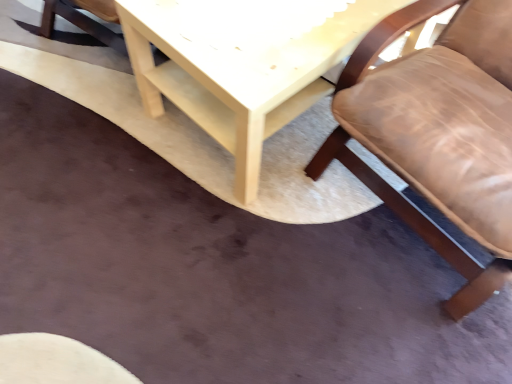
Question: Is brown leather chair at upper right inside or outside of light wood table at upper center?

Choices:
 (A) outside
 (B) inside

Answer: (A)

Question: Visually, is brown leather chair at upper right positioned to the left or to the right of light wood table at upper center?

Choices:
 (A) left
 (B) right

Answer: (B)

Question: In the image, is brown leather chair at upper right positioned in front of or behind light wood table at upper center?

Choices:
 (A) behind
 (B) front

Answer: (B)

Question: In terms of height, does light wood table at upper center look taller or shorter compared to brown leather chair at upper right?

Choices:
 (A) tall
 (B) short

Answer: (B)

Question: Is light wood table at upper center to the left or to the right of brown leather chair at upper right in the image?

Choices:
 (A) left
 (B) right

Answer: (A)

Question: From a real-world perspective, relative to brown leather chair at upper right, is light wood table at upper center vertically above or below?

Choices:
 (A) above
 (B) below

Answer: (B)

Question: Is light wood table at upper center wider or thinner than brown leather chair at upper right?

Choices:
 (A) wide
 (B) thin

Answer: (A)